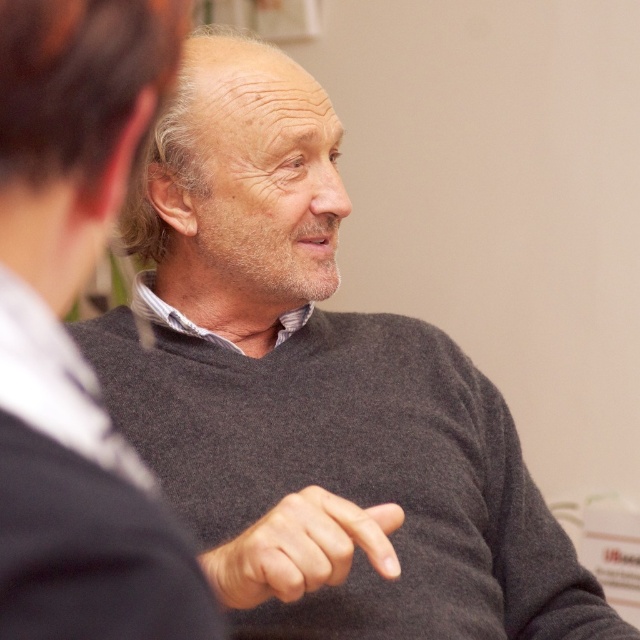
Based on the photo, which is more to the left, dark gray sweater at center or smooth gray finger at center?

dark gray sweater at center

Between point (45, 131) and point (204, 556), which one is positioned behind?

Positioned behind is point (204, 556).

This screenshot has height=640, width=640. What are the coordinates of `dark gray sweater at center` in the screenshot? It's located at (67, 336).